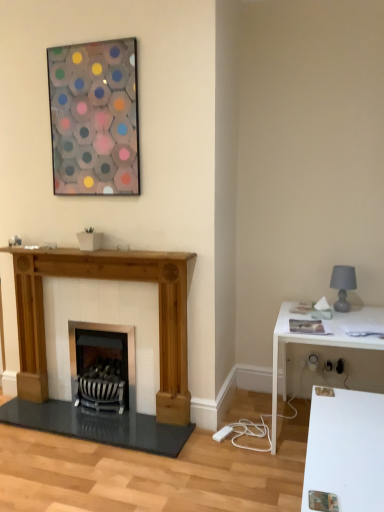
Where is `free space in front of natural wood fireplace at left`? The image size is (384, 512). free space in front of natural wood fireplace at left is located at coordinates (102, 470).